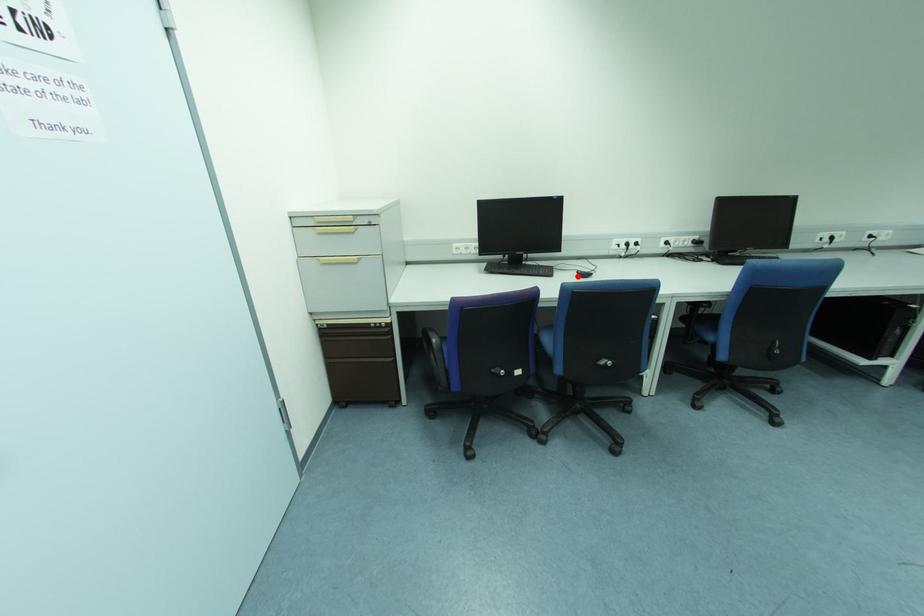
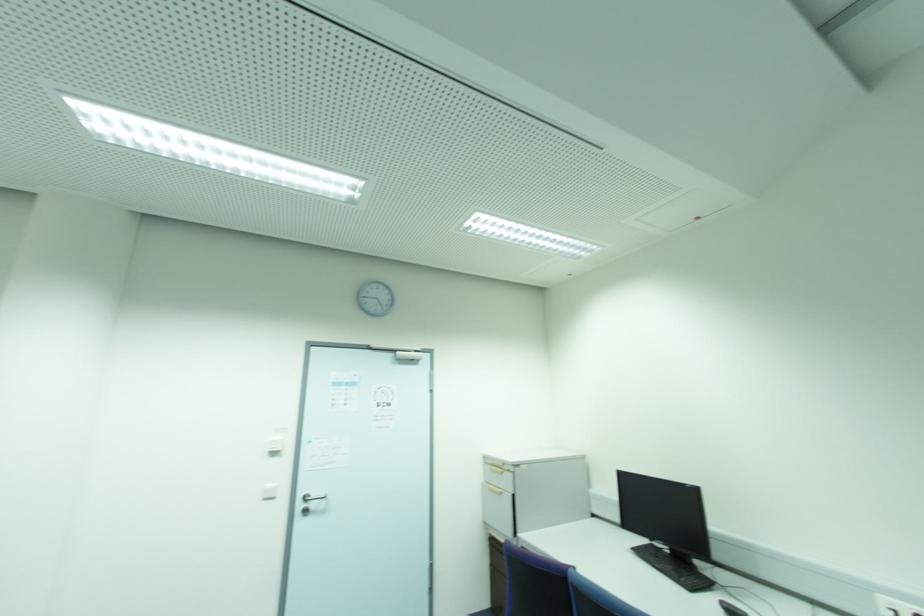
Question: I am providing you with two images of the same scene from different viewpoints. In image1, a red point is highlighted. Considering the same 3D point in image2, which of the following is correct?

Choices:
 (A) It is closer
 (B) It is farther

Answer: (A)